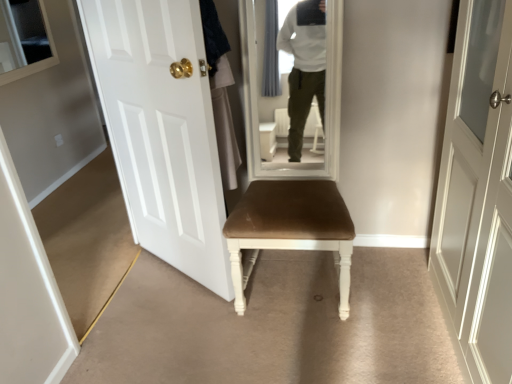
Question: Is brown velvet chair at center taller or shorter than white glossy door at left?

Choices:
 (A) short
 (B) tall

Answer: (A)

Question: From a real-world perspective, is brown velvet chair at center above or below white glossy door at left?

Choices:
 (A) above
 (B) below

Answer: (B)

Question: Would you say brown velvet chair at center is inside or outside white glossy door at left?

Choices:
 (A) inside
 (B) outside

Answer: (B)

Question: From a real-world perspective, is white glossy door at left positioned above or below brown velvet chair at center?

Choices:
 (A) below
 (B) above

Answer: (B)

Question: Based on their positions, is white glossy door at left located to the left or right of brown velvet chair at center?

Choices:
 (A) left
 (B) right

Answer: (A)

Question: From the image's perspective, is white glossy door at left above or below brown velvet chair at center?

Choices:
 (A) below
 (B) above

Answer: (B)

Question: Is white glossy door at left bigger or smaller than brown velvet chair at center?

Choices:
 (A) big
 (B) small

Answer: (B)